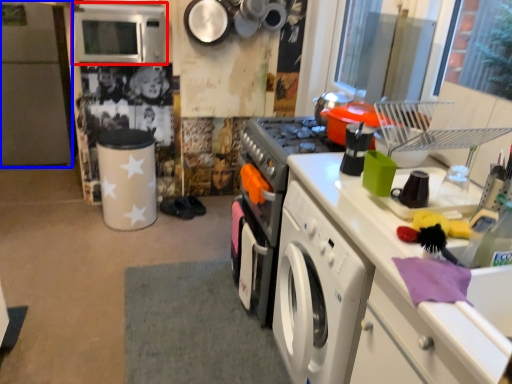
Question: Which point is closer to the camera, microwave oven (highlighted by a red box) or fridge (highlighted by a blue box)?

Choices:
 (A) microwave oven
 (B) fridge

Answer: (A)